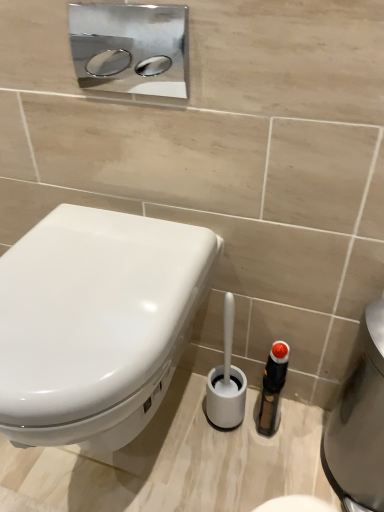
Image resolution: width=384 pixels, height=512 pixels. What do you see at coordinates (226, 380) in the screenshot?
I see `white plastic toilet brush at lower center` at bounding box center [226, 380].

This screenshot has width=384, height=512. What are the coordinates of `white glossy toilet at left` in the screenshot? It's located at (96, 323).

Where is `white plastic toilet brush at lower center`? white plastic toilet brush at lower center is located at coordinates (226, 380).

From a real-world perspective, is white plastic toilet brush at lower center physically located above or below silver metallic water heater at lower right?

white plastic toilet brush at lower center is situated lower than silver metallic water heater at lower right in the real world.

Is white plastic toilet brush at lower center oriented towards silver metallic water heater at lower right?

No, white plastic toilet brush at lower center is not facing towards silver metallic water heater at lower right.

Is white plastic toilet brush at lower center inside the boundaries of silver metallic water heater at lower right, or outside?

white plastic toilet brush at lower center is not enclosed by silver metallic water heater at lower right.

Who is taller, white plastic toilet brush at lower center or silver metallic water heater at lower right?

With more height is silver metallic water heater at lower right.

The image size is (384, 512). Find the location of `brush that is on the left side of silver metallic water heater at lower right`. brush that is on the left side of silver metallic water heater at lower right is located at coordinates (226, 380).

Between silver metallic water heater at lower right and white plastic toilet brush at lower center, which one has larger size?

silver metallic water heater at lower right is bigger.

Looking at this image, relative to white plastic toilet brush at lower center, is silver metallic water heater at lower right in front or behind?

In the image, silver metallic water heater at lower right appears in front of white plastic toilet brush at lower center.

From the image's perspective, is white glossy toilet at left under silver metallic water heater at lower right?

No.

At what (x,y) coordinates should I click in order to perform the action: click on water heater that appears on the right of white glossy toilet at left. Please return your answer as a coordinate pair (x, y). This screenshot has width=384, height=512. Looking at the image, I should click on (359, 422).

Considering the positions of points (140, 244) and (352, 388), is point (140, 244) farther from camera compared to point (352, 388)?

That is False.

From a real-world perspective, is white glossy toilet at left located higher than silver metallic water heater at lower right?

Yes, from a real-world perspective, white glossy toilet at left is over silver metallic water heater at lower right

Considering the sizes of objects white plastic toilet brush at lower center and white glossy toilet at left in the image provided, who is shorter, white plastic toilet brush at lower center or white glossy toilet at left?

Standing shorter between the two is white plastic toilet brush at lower center.

Would you say white plastic toilet brush at lower center is a long distance from white glossy toilet at left?

white plastic toilet brush at lower center is actually quite close to white glossy toilet at left.

Which object is more forward, white plastic toilet brush at lower center or white glossy toilet at left?

white glossy toilet at left is in front.

Which is more to the left, white plastic toilet brush at lower center or white glossy toilet at left?

Positioned to the left is white glossy toilet at left.

Which object is more forward, silver metallic water heater at lower right or white glossy toilet at left?

white glossy toilet at left is closer to the camera.

Is silver metallic water heater at lower right to the right of white glossy toilet at left from the viewer's perspective?

Yes, silver metallic water heater at lower right is to the right of white glossy toilet at left.

Is white glossy toilet at left wider or thinner than white plastic toilet brush at lower center?

Clearly, white glossy toilet at left has more width compared to white plastic toilet brush at lower center.

Would you say white plastic toilet brush at lower center is part of white glossy toilet at left's contents?

That's incorrect, white plastic toilet brush at lower center is not inside white glossy toilet at left.

From a real-world perspective, is white glossy toilet at left below white plastic toilet brush at lower center?

No, from a real-world perspective, white glossy toilet at left is not under white plastic toilet brush at lower center.

Is white glossy toilet at left in front of or behind white plastic toilet brush at lower center in the image?

white glossy toilet at left is in front of white plastic toilet brush at lower center.

Where is `water heater located above the white plastic toilet brush at lower center (from a real-world perspective)`? This screenshot has height=512, width=384. water heater located above the white plastic toilet brush at lower center (from a real-world perspective) is located at coordinates (359, 422).

The height and width of the screenshot is (512, 384). I want to click on water heater below the white plastic toilet brush at lower center (from the image's perspective), so [x=359, y=422].

From the picture: Considering their positions, is white glossy toilet at left positioned closer to silver metallic water heater at lower right than white plastic toilet brush at lower center?

white plastic toilet brush at lower center lies closer to silver metallic water heater at lower right than the other object.

Estimate the real-world distances between objects in this image. Which object is closer to white plastic toilet brush at lower center, white glossy toilet at left or silver metallic water heater at lower right?

The object closer to white plastic toilet brush at lower center is white glossy toilet at left.

From the picture: Looking at the image, which one is located further to silver metallic water heater at lower right, white plastic toilet brush at lower center or white glossy toilet at left?

white glossy toilet at left lies further to silver metallic water heater at lower right than the other object.

Considering their positions, is silver metallic water heater at lower right positioned closer to white plastic toilet brush at lower center than white glossy toilet at left?

white glossy toilet at left.

From the image, which object appears to be nearer to white glossy toilet at left, silver metallic water heater at lower right or white plastic toilet brush at lower center?

white plastic toilet brush at lower center.

Considering their positions, is white plastic toilet brush at lower center positioned further to white glossy toilet at left than silver metallic water heater at lower right?

Among the two, silver metallic water heater at lower right is located further to white glossy toilet at left.

At what (x,y) coordinates should I click in order to perform the action: click on brush between white glossy toilet at left and silver metallic water heater at lower right from left to right. Please return your answer as a coordinate pair (x, y). Looking at the image, I should click on (226, 380).